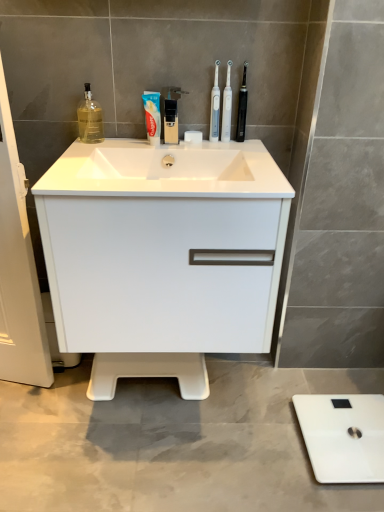
Where is `blue glossy toothpaste at center`? The image size is (384, 512). blue glossy toothpaste at center is located at coordinates 152,116.

What is the approximate width of white glossy sink at center?

white glossy sink at center is 19.63 inches wide.

You are a GUI agent. You are given a task and a screenshot of the screen. Output one action in this format:
    pyautogui.click(x=<x>, y=<y>)
    Task: Click on the white glossy sink at center
    Image resolution: width=384 pixels, height=512 pixels.
    Given the screenshot: What is the action you would take?
    pyautogui.click(x=166, y=170)

What do you see at coordinates (162, 256) in the screenshot? This screenshot has width=384, height=512. I see `white glossy cabinet at center` at bounding box center [162, 256].

Find the location of a particular element. white glossy cabinet at center is located at coordinates (162, 256).

In order to face black plastic toothbrush at upper center, the first toothbrush viewed from the right, should I rotate leftwards or rightwards?

You should rotate right by 6.911 degrees.

This screenshot has height=512, width=384. Identify the location of black plastic faucet at upper center. (171, 113).

What do you see at coordinates (215, 106) in the screenshot? I see `white plastic toothbrush at upper center, placed as the first toothbrush when sorted from left to right` at bounding box center [215, 106].

Measure the distance between point (216, 76) and camera.

Point (216, 76) and camera are 1.32 meters apart.

The height and width of the screenshot is (512, 384). Describe the element at coordinates (227, 106) in the screenshot. I see `white glossy toothbrush at upper center, which is the second toothbrush in right-to-left order` at that location.

Where is `white matte scale at lower right`? Image resolution: width=384 pixels, height=512 pixels. white matte scale at lower right is located at coordinates (343, 436).

You are a GUI agent. You are given a task and a screenshot of the screen. Output one action in this format:
    pyautogui.click(x=<x>, y=<y>)
    Task: Click on the blue glossy toothpaste at center
    The height and width of the screenshot is (512, 384).
    Given the screenshot: What is the action you would take?
    pyautogui.click(x=152, y=116)

From the image's perspective, is black plastic toothbrush at upper center, the first toothbrush viewed from the right, located above or below white glossy toothbrush at upper center, the 2th toothbrush from the left?

black plastic toothbrush at upper center, the first toothbrush viewed from the right, is situated higher than white glossy toothbrush at upper center, the 2th toothbrush from the left, in the image.

What's the angular difference between black plastic toothbrush at upper center, the third toothbrush in the left-to-right sequence, and white glossy toothbrush at upper center, the 2th toothbrush from the left,'s facing directions?

They differ by 0.0149 degrees in their facing directions.

Looking at this image, can you confirm if black plastic toothbrush at upper center, the first toothbrush viewed from the right, is positioned to the left of white glossy toothbrush at upper center, which is the second toothbrush in right-to-left order?

In fact, black plastic toothbrush at upper center, the first toothbrush viewed from the right, is to the right of white glossy toothbrush at upper center, which is the second toothbrush in right-to-left order.

You are a GUI agent. You are given a task and a screenshot of the screen. Output one action in this format:
    pyautogui.click(x=<x>, y=<y>)
    Task: Click on the toothbrush that is the 2nd object located behind the white glossy toothbrush at upper center, the 2th toothbrush from the left
    This screenshot has height=512, width=384.
    Given the screenshot: What is the action you would take?
    pyautogui.click(x=242, y=108)

Which is in front, blue glossy toothpaste at center or white glossy cabinet at center?

Positioned in front is white glossy cabinet at center.

Which of these two, blue glossy toothpaste at center or white glossy cabinet at center, is wider?

white glossy cabinet at center is wider.

Can you tell me how much black plastic faucet at upper center and white matte scale at lower right differ in facing direction?

91.7 degrees.

Between black plastic faucet at upper center and white matte scale at lower right, which one is positioned in front?

black plastic faucet at upper center is in front.

From the image's perspective, which object appears higher, black plastic faucet at upper center or white matte scale at lower right?

black plastic faucet at upper center appears higher in the image.

Considering the relative sizes of black plastic faucet at upper center and white matte scale at lower right in the image provided, is black plastic faucet at upper center wider than white matte scale at lower right?

In fact, black plastic faucet at upper center might be narrower than white matte scale at lower right.

Which object is further away from the camera taking this photo, blue glossy toothpaste at center or black plastic toothbrush at upper center, the third toothbrush in the left-to-right sequence?

black plastic toothbrush at upper center, the third toothbrush in the left-to-right sequence.

Is blue glossy toothpaste at center aimed at black plastic toothbrush at upper center, the third toothbrush in the left-to-right sequence?

No, blue glossy toothpaste at center is not turned towards black plastic toothbrush at upper center, the third toothbrush in the left-to-right sequence.

At what (x,y) coordinates should I click in order to perform the action: click on toothpaste located underneath the black plastic toothbrush at upper center, the first toothbrush viewed from the right (from a real-world perspective). Please return your answer as a coordinate pair (x, y). The image size is (384, 512). Looking at the image, I should click on (152, 116).

Could you tell me if blue glossy toothpaste at center is turned towards clear glass bottle at upper left?

No, blue glossy toothpaste at center does not turn towards clear glass bottle at upper left.

From the image's perspective, which one is positioned higher, blue glossy toothpaste at center or clear glass bottle at upper left?

clear glass bottle at upper left is shown above in the image.

Considering the relative sizes of blue glossy toothpaste at center and clear glass bottle at upper left in the image provided, is blue glossy toothpaste at center taller than clear glass bottle at upper left?

Incorrect, the height of blue glossy toothpaste at center is not larger of that of clear glass bottle at upper left.

What's the angular difference between blue glossy toothpaste at center and clear glass bottle at upper left's facing directions?

The facing directions of blue glossy toothpaste at center and clear glass bottle at upper left are 0.294 degrees apart.

From a real-world perspective, is blue glossy toothpaste at center above or below white matte scale at lower right?

From a real-world perspective, blue glossy toothpaste at center is physically above white matte scale at lower right.

From the image's perspective, is blue glossy toothpaste at center located above white matte scale at lower right?

Yes, from the image's perspective, blue glossy toothpaste at center is above white matte scale at lower right.

Could you tell me if blue glossy toothpaste at center is turned towards white matte scale at lower right?

No, blue glossy toothpaste at center is not aimed at white matte scale at lower right.

Is blue glossy toothpaste at center bigger or smaller than white matte scale at lower right?

Clearly, blue glossy toothpaste at center is smaller in size than white matte scale at lower right.

Can we say white glossy toothbrush at upper center, the 2th toothbrush from the left, lies outside white glossy cabinet at center?

Yes, white glossy toothbrush at upper center, the 2th toothbrush from the left, is not within white glossy cabinet at center.

From the image's perspective, is white glossy toothbrush at upper center, the 2th toothbrush from the left, on top of white glossy cabinet at center?

Yes.

From a real-world perspective, which toothbrush is the 1st one underneath the black plastic toothbrush at upper center, the first toothbrush viewed from the right? Please provide its 2D coordinates.

[(227, 106)]

This screenshot has height=512, width=384. What are the coordinates of `toothpaste behind the white glossy cabinet at center` in the screenshot? It's located at (152, 116).

Based on their spatial positions, is white glossy toothbrush at upper center, the 2th toothbrush from the left, or white plastic toothbrush at upper center, which is the third toothbrush from right to left, further from blue glossy toothpaste at center?

Among the two, white glossy toothbrush at upper center, the 2th toothbrush from the left, is located further to blue glossy toothpaste at center.

Based on their spatial positions, is white glossy cabinet at center or clear glass bottle at upper left further from blue glossy toothpaste at center?

Based on the image, white glossy cabinet at center appears to be further to blue glossy toothpaste at center.

Considering their positions, is blue glossy toothpaste at center positioned closer to black plastic toothbrush at upper center, the first toothbrush viewed from the right, than black plastic faucet at upper center?

Among the two, black plastic faucet at upper center is located nearer to black plastic toothbrush at upper center, the first toothbrush viewed from the right.

When comparing their distances from black plastic toothbrush at upper center, the third toothbrush in the left-to-right sequence, does white matte scale at lower right or clear glass bottle at upper left seem closer?

clear glass bottle at upper left lies closer to black plastic toothbrush at upper center, the third toothbrush in the left-to-right sequence, than the other object.

Based on their spatial positions, is white plastic toothbrush at upper center, which is the third toothbrush from right to left, or black plastic toothbrush at upper center, the third toothbrush in the left-to-right sequence, further from white glossy toothbrush at upper center, the 2th toothbrush from the left?

Among the two, black plastic toothbrush at upper center, the third toothbrush in the left-to-right sequence, is located further to white glossy toothbrush at upper center, the 2th toothbrush from the left.

Consider the image. Looking at the image, which one is located further to blue glossy toothpaste at center, clear glass bottle at upper left or white glossy sink at center?

Based on the image, white glossy sink at center appears to be further to blue glossy toothpaste at center.

Looking at this image, from the image, which object appears to be farther from white plastic toothbrush at upper center, which is the third toothbrush from right to left, white matte scale at lower right or clear glass bottle at upper left?

Based on the image, white matte scale at lower right appears to be further to white plastic toothbrush at upper center, which is the third toothbrush from right to left.

Looking at the image, which one is located closer to blue glossy toothpaste at center, white matte scale at lower right or white glossy toothbrush at upper center, the 2th toothbrush from the left?

The object closer to blue glossy toothpaste at center is white glossy toothbrush at upper center, the 2th toothbrush from the left.

At what (x,y) coordinates should I click in order to perform the action: click on toothbrush situated between white plastic toothbrush at upper center, which is the third toothbrush from right to left, and black plastic toothbrush at upper center, the third toothbrush in the left-to-right sequence, from left to right. Please return your answer as a coordinate pair (x, y). Looking at the image, I should click on (227, 106).

The image size is (384, 512). What are the coordinates of `toothpaste that lies between white plastic toothbrush at upper center, placed as the first toothbrush when sorted from left to right, and white matte scale at lower right from top to bottom` in the screenshot? It's located at (152, 116).

Where is `faucet between clear glass bottle at upper left and white plastic toothbrush at upper center, which is the third toothbrush from right to left`? The height and width of the screenshot is (512, 384). faucet between clear glass bottle at upper left and white plastic toothbrush at upper center, which is the third toothbrush from right to left is located at coordinates (171, 113).

Identify the location of cleaning product between white glossy toothbrush at upper center, the 2th toothbrush from the left, and white glossy cabinet at center vertically. (90, 118).